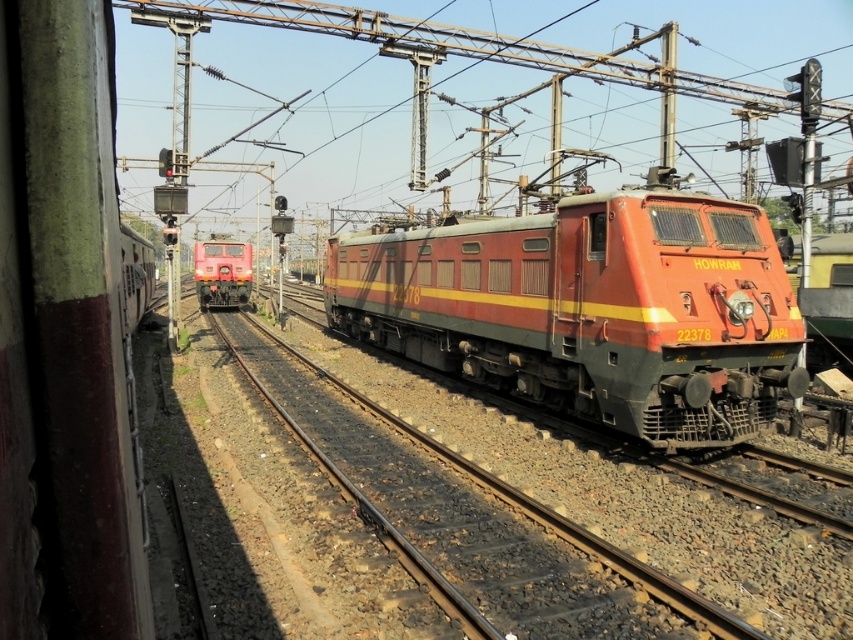
Which of these two, matte red locomotive at center or metallic train track at center, stands taller?

matte red locomotive at center

Can you confirm if matte red locomotive at center is positioned above metallic train track at center?

Correct, matte red locomotive at center is located above metallic train track at center.

This screenshot has height=640, width=853. Find the location of `matte red locomotive at center`. matte red locomotive at center is located at coordinates (590, 308).

Does point (534, 628) come behind point (206, 264)?

No.

Can you confirm if metallic train track at center is positioned below matte red train at center?

Yes, metallic train track at center is below matte red train at center.

Where is `metallic train track at center`? This screenshot has height=640, width=853. metallic train track at center is located at coordinates (459, 508).

Who is shorter, matte red locomotive at center or matte red train at center?

matte red train at center is shorter.

Is matte red locomotive at center smaller than matte red train at center?

No, matte red locomotive at center is not smaller than matte red train at center.

What do you see at coordinates (590, 308) in the screenshot?
I see `matte red locomotive at center` at bounding box center [590, 308].

Locate an element on the screen. This screenshot has width=853, height=640. matte red locomotive at center is located at coordinates (590, 308).